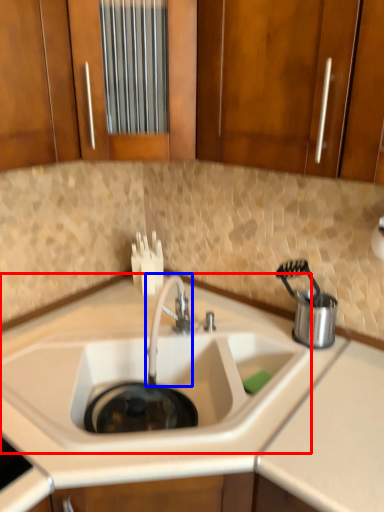
Question: Among these objects, which one is nearest to the camera, sink (highlighted by a red box) or tap (highlighted by a blue box)?

Choices:
 (A) sink
 (B) tap

Answer: (A)